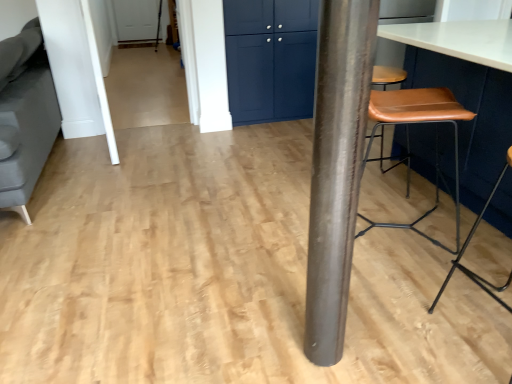
Where is `space that is in front of shiny metallic pole at center`? This screenshot has width=512, height=384. space that is in front of shiny metallic pole at center is located at coordinates (328, 374).